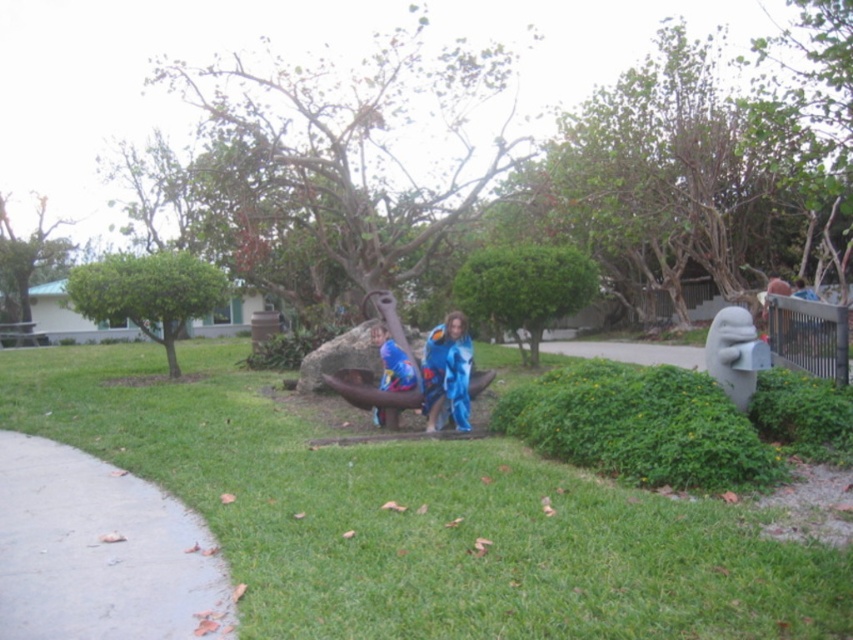
Which is more to the left, green grass at center or blue fabric costume at center?

From the viewer's perspective, green grass at center appears more on the left side.

Between point (570, 502) and point (387, 340), which one is positioned behind?

Positioned behind is point (387, 340).

The width and height of the screenshot is (853, 640). What do you see at coordinates (421, 518) in the screenshot?
I see `green grass at center` at bounding box center [421, 518].

Where is `green grass at center`? green grass at center is located at coordinates (421, 518).

Which of these two, green leafy bush at center or blue fabric costume at center, stands shorter?

With less height is blue fabric costume at center.

Does green leafy bush at center lie behind blue fabric costume at center?

That is True.

Locate an element on the screen. The image size is (853, 640). green leafy bush at center is located at coordinates click(x=524, y=289).

You are a GUI agent. You are given a task and a screenshot of the screen. Output one action in this format:
    pyautogui.click(x=<x>, y=<y>)
    Task: Click on the green leafy bush at center
    
    Given the screenshot: What is the action you would take?
    pyautogui.click(x=524, y=289)

Is green leafy bush at center further to camera compared to blue fabric at center?

Yes, green leafy bush at center is behind blue fabric at center.

Which is behind, point (512, 276) or point (422, 369)?

The point (512, 276) is behind.

Identify the location of green leafy bush at center. The image size is (853, 640). (524, 289).